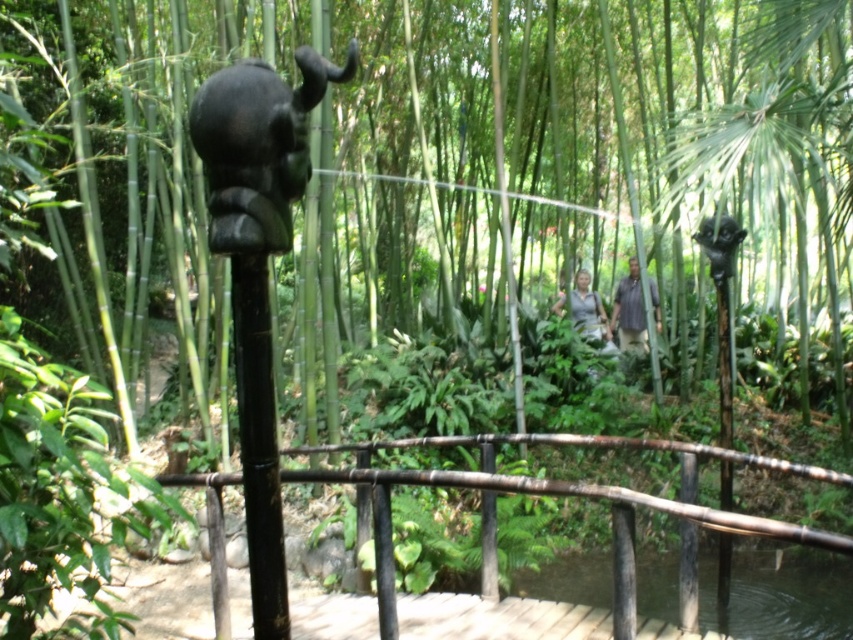
Question: Which is farther from the green textured shirt at center?

Choices:
 (A) black polished pole at center
 (B) clear water at pond center
 (C) black polished elephant head at center

Answer: (A)

Question: Which of the following is the closest to the observer?

Choices:
 (A) tap(627, 323)
 (B) tap(724, 326)

Answer: (B)

Question: Is black glossy elephant at upper center positioned in front of black polished pole at center?

Choices:
 (A) yes
 (B) no

Answer: (A)

Question: Which of the following is the closest to the observer?

Choices:
 (A) (206, 134)
 (B) (724, 536)
 (C) (778, 589)
 (D) (259, 493)

Answer: (A)

Question: Can you confirm if dark brown bamboo rail at center is smaller than black glossy elephant at upper center?

Choices:
 (A) no
 (B) yes

Answer: (A)

Question: Is black glossy elephant at upper center bigger than black polished wood pole at right?

Choices:
 (A) no
 (B) yes

Answer: (A)